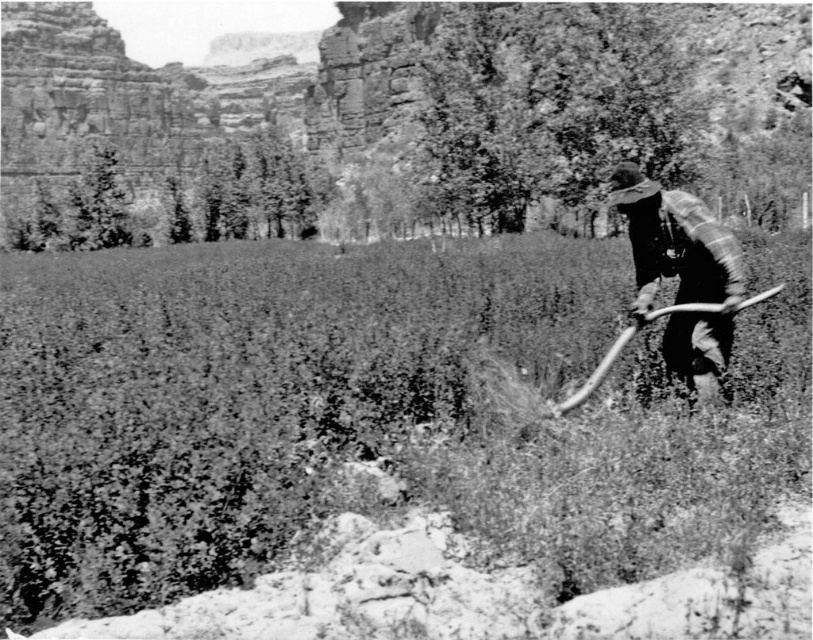
Image resolution: width=813 pixels, height=640 pixels. What do you see at coordinates (333, 413) in the screenshot?
I see `coarse textured grass at center` at bounding box center [333, 413].

Who is lower down, coarse textured grass at center or plaid fabric shirt at right?

coarse textured grass at center

Describe the element at coordinates (333, 413) in the screenshot. This screenshot has width=813, height=640. I see `coarse textured grass at center` at that location.

The height and width of the screenshot is (640, 813). Identify the location of coarse textured grass at center. (333, 413).